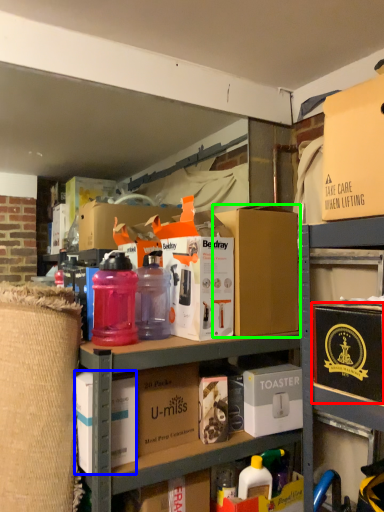
Question: Based on their relative distances, which object is nearer to box (highlighted by a red box)? Choose from box (highlighted by a blue box) and box (highlighted by a green box).

Choices:
 (A) box
 (B) box

Answer: (B)